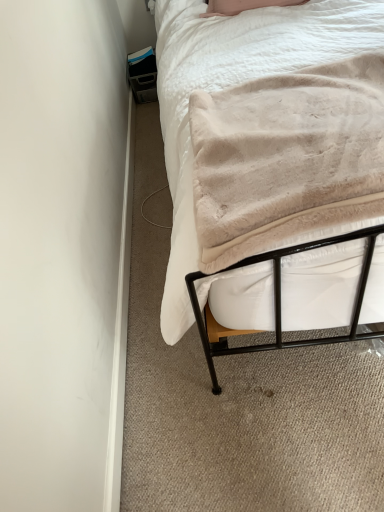
Measure the distance between beige plush blanket at upper right and camera.

beige plush blanket at upper right is 28.79 inches away from camera.

What do you see at coordinates (272, 164) in the screenshot?
I see `beige plush blanket at upper right` at bounding box center [272, 164].

The height and width of the screenshot is (512, 384). In order to click on beige plush blanket at upper right in this screenshot , I will do `click(272, 164)`.

This screenshot has width=384, height=512. I want to click on beige plush blanket at center, so click(287, 157).

What do you see at coordinates (287, 157) in the screenshot? I see `beige plush blanket at center` at bounding box center [287, 157].

The image size is (384, 512). In order to click on beige plush blanket at upper right in this screenshot , I will do `click(272, 164)`.

Can you confirm if beige plush blanket at center is positioned to the left of beige plush blanket at upper right?

No, beige plush blanket at center is not to the left of beige plush blanket at upper right.

In the image, is beige plush blanket at center positioned in front of or behind beige plush blanket at upper right?

Clearly, beige plush blanket at center is in front of beige plush blanket at upper right.

Considering the points (248, 137) and (269, 203), which point is behind, point (248, 137) or point (269, 203)?

The point (248, 137) is farther from the camera.

From the image's perspective, is beige plush blanket at center below beige plush blanket at upper right?

Indeed, from the image's perspective, beige plush blanket at center is shown beneath beige plush blanket at upper right.

From a real-world perspective, is beige plush blanket at center on beige plush blanket at upper right?

Indeed, from a real-world perspective, beige plush blanket at center stands above beige plush blanket at upper right.

Between beige plush blanket at center and beige plush blanket at upper right, which one has larger width?

Wider between the two is beige plush blanket at upper right.

Which of these two, beige plush blanket at center or beige plush blanket at upper right, stands taller?

beige plush blanket at center.

Which of these two, beige plush blanket at center or beige plush blanket at upper right, is bigger?

Bigger between the two is beige plush blanket at upper right.

Would you say beige plush blanket at center contains beige plush blanket at upper right?

Definitely not — beige plush blanket at upper right is not inside beige plush blanket at center.

Would you consider beige plush blanket at center to be distant from beige plush blanket at upper right?

beige plush blanket at center is actually quite close to beige plush blanket at upper right.

Based on the photo, is beige plush blanket at center aimed at beige plush blanket at upper right?

No.

How different are the orientations of beige plush blanket at center and beige plush blanket at upper right in degrees?

90.6 degrees.

At what (x,y) coordinates should I click in order to perform the action: click on blanket located on the right of beige plush blanket at upper right. Please return your answer as a coordinate pair (x, y). Looking at the image, I should click on (287, 157).

Does beige plush blanket at upper right appear on the left side of beige plush blanket at center?

Correct, you'll find beige plush blanket at upper right to the left of beige plush blanket at center.

Is beige plush blanket at upper right in front of or behind beige plush blanket at center in the image?

beige plush blanket at upper right is positioned farther from the viewer than beige plush blanket at center.

Does point (238, 144) appear closer or farther from the camera than point (247, 135)?

Point (238, 144) is positioned closer to the camera compared to point (247, 135).

From the image's perspective, which is above, beige plush blanket at upper right or beige plush blanket at center?

From the image's view, beige plush blanket at upper right is above.

From a real-world perspective, between beige plush blanket at upper right and beige plush blanket at center, who is vertically higher?

beige plush blanket at center.

Between beige plush blanket at upper right and beige plush blanket at center, which one has larger width?

beige plush blanket at upper right is wider.

Which of these two, beige plush blanket at upper right or beige plush blanket at center, stands shorter?

With less height is beige plush blanket at upper right.

Can you confirm if beige plush blanket at upper right is bigger than beige plush blanket at center?

Yes, beige plush blanket at upper right is bigger than beige plush blanket at center.

Is beige plush blanket at upper right completely or partially outside of beige plush blanket at center?

Yes.

Is beige plush blanket at upper right positioned far away from beige plush blanket at center?

beige plush blanket at upper right is near beige plush blanket at center, not far away.

Is beige plush blanket at upper right looking in the opposite direction of beige plush blanket at center?

No, beige plush blanket at upper right's orientation is not away from beige plush blanket at center.

How many degrees apart are the facing directions of beige plush blanket at upper right and beige plush blanket at center?

beige plush blanket at upper right and beige plush blanket at center are facing 90.6 degrees away from each other.

Identify the location of bed that appears above the beige plush blanket at center (from the image's perspective). This screenshot has height=512, width=384. click(272, 164).

The height and width of the screenshot is (512, 384). There is a beige plush blanket at upper right. Find the location of `blanket above it (from a real-world perspective)`. blanket above it (from a real-world perspective) is located at coordinates (287, 157).

Where is `blanket on the right of beige plush blanket at upper right`? This screenshot has height=512, width=384. blanket on the right of beige plush blanket at upper right is located at coordinates (287, 157).